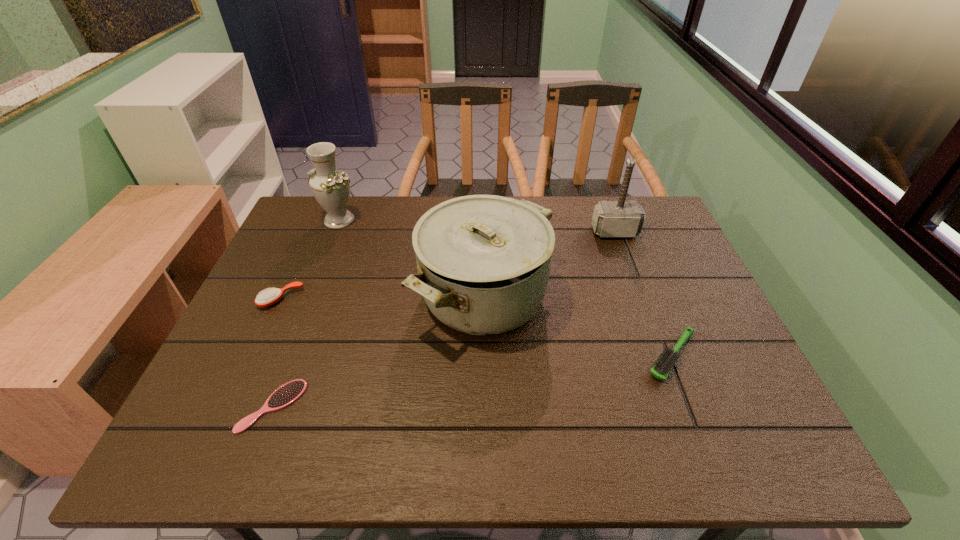
I want to click on object that is at the far right corner, so coord(621,218).

This screenshot has height=540, width=960. In the image, there is a desktop. What are the coordinates of `free space at the far edge` in the screenshot? It's located at (590, 230).

Image resolution: width=960 pixels, height=540 pixels. Identify the location of free spot at the near edge of the desktop. (599, 424).

This screenshot has height=540, width=960. In the image, there is a desktop. What are the coordinates of `vacant space at the left edge` in the screenshot? It's located at (198, 406).

Where is `free space at the right edge`? Image resolution: width=960 pixels, height=540 pixels. free space at the right edge is located at coordinates (734, 397).

In the image, there is a desktop. At what (x,y) coordinates should I click in order to perform the action: click on free space at the near left corner. Please return your answer as a coordinate pair (x, y). Looking at the image, I should click on (217, 424).

This screenshot has height=540, width=960. I want to click on free spot between the third object from right to left and the vase, so click(x=411, y=258).

At what (x,y) coordinates should I click in order to perform the action: click on free space between the shortest hairbrush and the fourth object from left to right. Please return your answer as a coordinate pair (x, y). The image size is (960, 540). Looking at the image, I should click on [378, 351].

This screenshot has width=960, height=540. Identify the location of vacant area between the rightmost hairbrush and the saucepan. (578, 326).

The height and width of the screenshot is (540, 960). In order to click on free point between the rightmost hairbrush and the shortest object in this screenshot , I will do `click(472, 381)`.